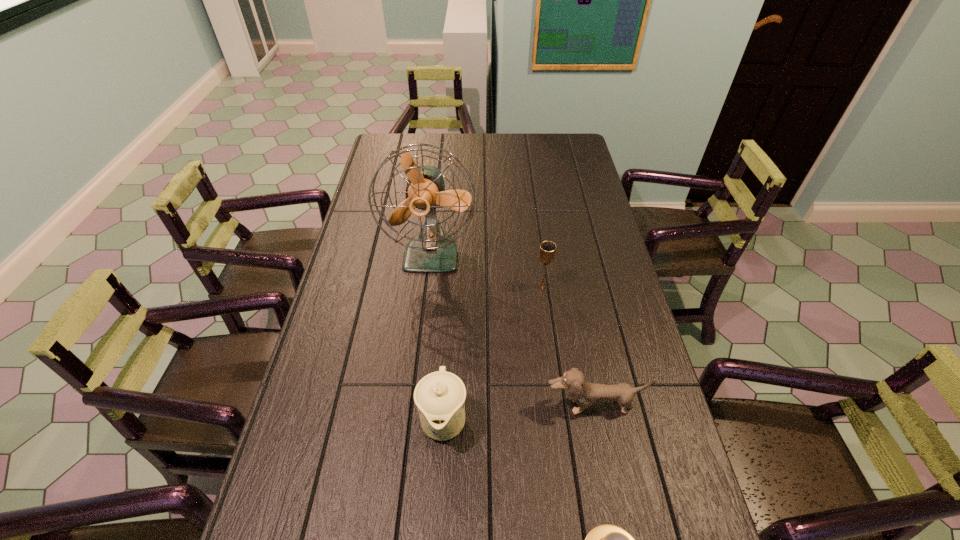
You are a GUI agent. You are given a task and a screenshot of the screen. Output one action in this format:
    pyautogui.click(x=<x>, y=<y>)
    Task: Click on the tallest object
    The height and width of the screenshot is (540, 960).
    Given the screenshot: What is the action you would take?
    pyautogui.click(x=431, y=250)

Where is `chalice`? chalice is located at coordinates (547, 251).

Where is `chinaware`? The width and height of the screenshot is (960, 540). chinaware is located at coordinates (439, 396).

The width and height of the screenshot is (960, 540). I want to click on puppy, so click(x=585, y=394).

Locate an element on the screen. This screenshot has width=960, height=540. free space located 0.330m on the front-facing side of the fan for air flow is located at coordinates (418, 377).

This screenshot has height=540, width=960. I want to click on vacant space located 0.260m on the left of the chalice, so click(453, 287).

What are the coordinates of `free space located on the spout of the chinaware` in the screenshot? It's located at (439, 500).

Identify the location of vacant area situated at the face of the puppy. Image resolution: width=960 pixels, height=540 pixels. (602, 454).

Where is `object that is at the left edge`? object that is at the left edge is located at coordinates (431, 250).

At what (x,y) coordinates should I click in order to perform the action: click on object located at the right edge. Please return your answer as a coordinate pair (x, y). The height and width of the screenshot is (540, 960). Looking at the image, I should click on (585, 394).